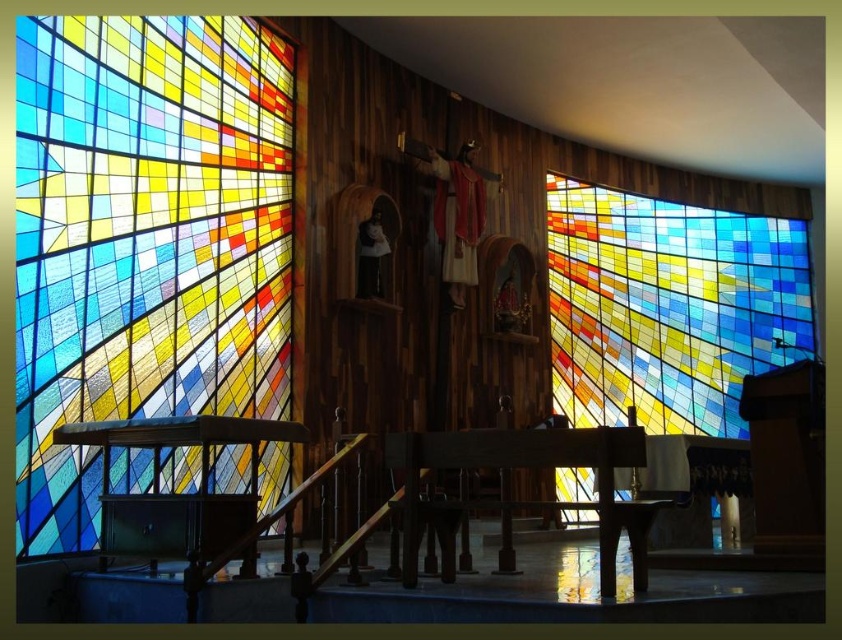
Locate an element on the screen. Image resolution: width=842 pixels, height=640 pixels. stained glass window at left is located at coordinates (144, 240).

Can you confirm if stained glass window at left is shorter than stained glass window at right?

Yes, stained glass window at left is shorter than stained glass window at right.

Find the location of `stained glass window at left`. stained glass window at left is located at coordinates (144, 240).